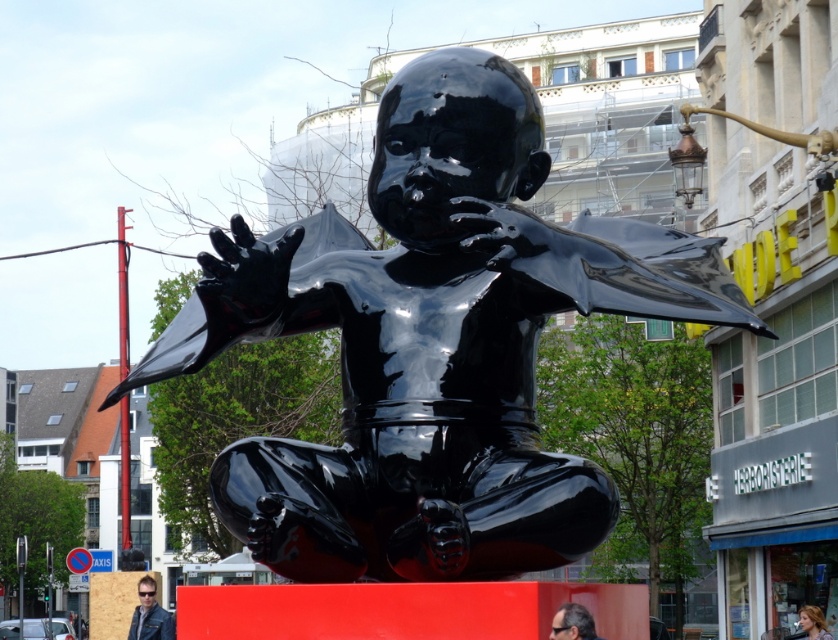
Question: Estimate the real-world distances between objects in this image. Which object is farther from the leather jacket at lower left?

Choices:
 (A) dark brown hair at lower center
 (B) blonde hair at lower right
 (C) glossy black baby at center

Answer: (A)

Question: Which point appears closest to the camera in this image?

Choices:
 (A) (555, 628)
 (B) (810, 611)
 (C) (247, 472)

Answer: (A)

Question: Can you confirm if dark brown hair at lower center is positioned to the right of blonde hair at lower right?

Choices:
 (A) yes
 (B) no

Answer: (B)

Question: From the image, what is the correct spatial relationship of glossy black baby at center in relation to dark brown hair at lower center?

Choices:
 (A) right
 (B) left

Answer: (B)

Question: Which of the following is the closest to the observer?

Choices:
 (A) glossy black baby at center
 (B) leather jacket at lower left
 (C) dark brown hair at lower center
 (D) blonde hair at lower right

Answer: (A)

Question: Is leather jacket at lower left above dark brown hair at lower center?

Choices:
 (A) no
 (B) yes

Answer: (A)